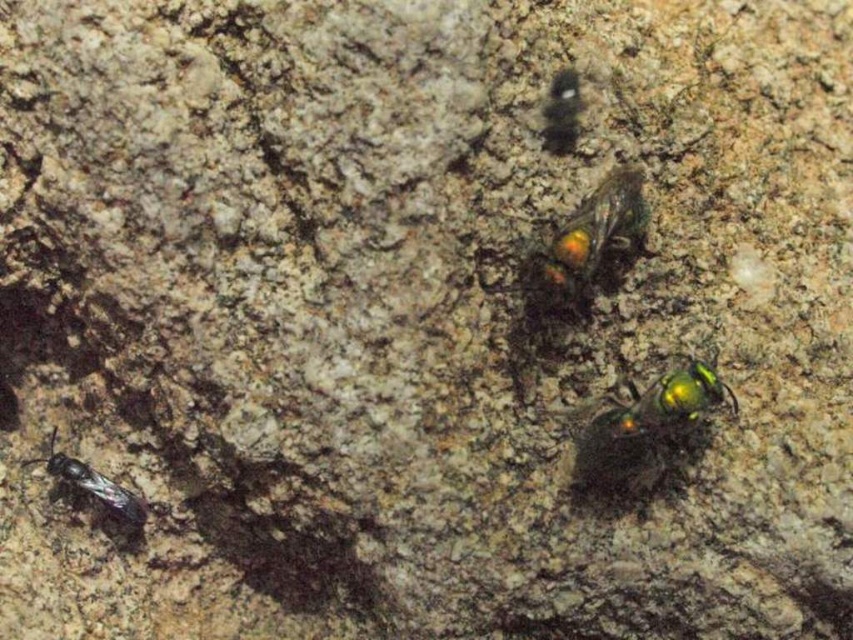
You are an insect explorer on the textured surface. You see two points marked on the surface. If you start moving from point point (671, 419) towards point point (142, 509), will you encounter any obstacles between them based on their spatial relationship?

Since point (671, 419) is in front of point (142, 509), moving from point (671, 419) towards point (142, 509) would mean moving backward relative to your current position. However, there are no objects mentioned between them, so there are no obstacles in that direction.

You are observing two metallic bees on a rough surface. The metallic green bee at center and the shiny metallic bee at lower left. Which one is positioned to the right of the other?

The metallic green bee at center is positioned to the right of the shiny metallic bee at lower left.